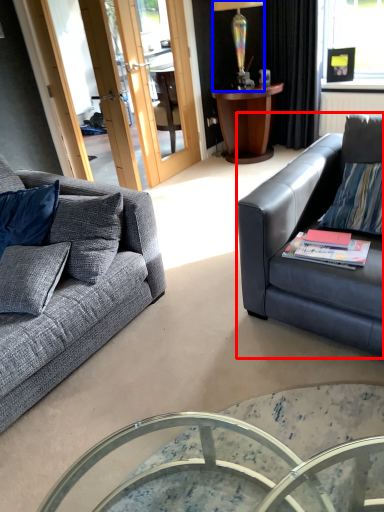
Question: Among these objects, which one is nearest to the camera, studio couch (highlighted by a red box) or lamp (highlighted by a blue box)?

Choices:
 (A) studio couch
 (B) lamp

Answer: (A)